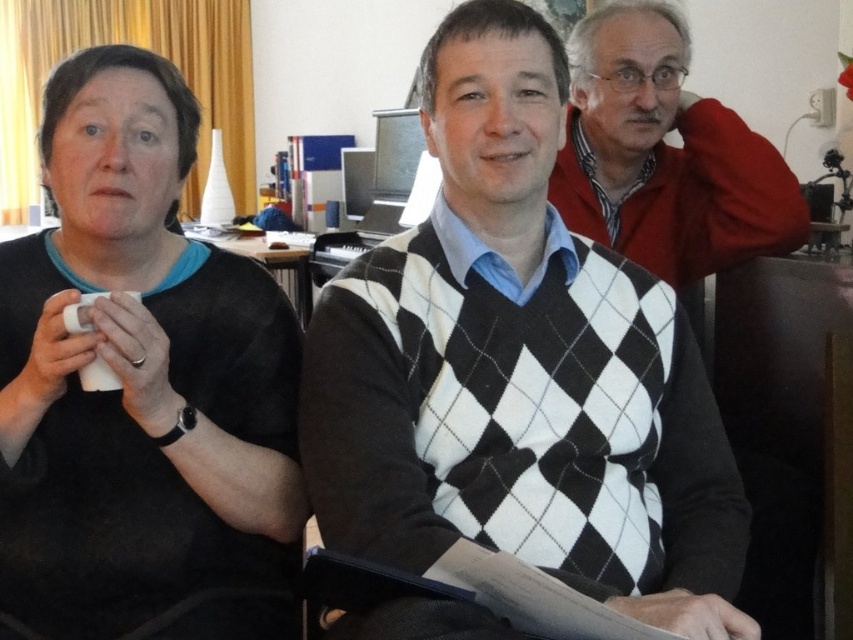
Question: Considering the relative positions of black and white argyle sweater at center and matte red sweater at upper right in the image provided, where is black and white argyle sweater at center located with respect to matte red sweater at upper right?

Choices:
 (A) left
 (B) right

Answer: (A)

Question: Considering the real-world distances, which object is farthest from the matte red sweater at upper right?

Choices:
 (A) black matte sweater at left
 (B) black and white argyle sweater at center

Answer: (A)

Question: Does black matte sweater at left have a lesser width compared to matte red sweater at upper right?

Choices:
 (A) no
 (B) yes

Answer: (B)

Question: Can you confirm if black matte sweater at left is smaller than matte red sweater at upper right?

Choices:
 (A) no
 (B) yes

Answer: (A)

Question: Among these points, which one is farthest from the camera?

Choices:
 (A) (282, 312)
 (B) (651, 83)

Answer: (B)

Question: Which of the following is the farthest from the observer?

Choices:
 (A) (672, 259)
 (B) (444, 212)

Answer: (A)